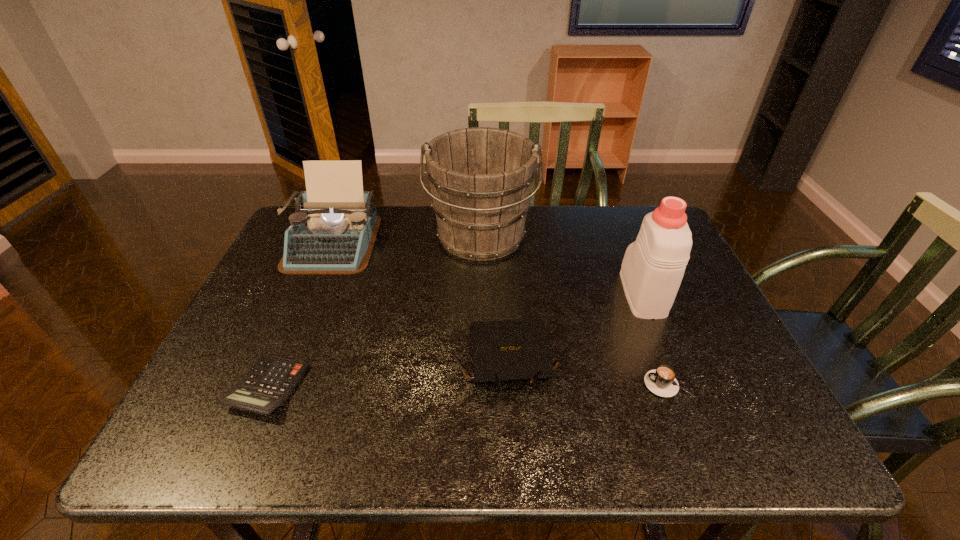
Identify which object is the second nearest to the third tallest object. Please provide its 2D coordinates. Your answer should be formatted as a tuple, i.e. [(x, y)], where the tuple contains the x and y coordinates of a point satisfying the conditions above.

[(268, 384)]

Where is `vacant area that satisfies the following two spatial constraints: 1. on the handle side of the bucket; 2. on the left side of the router`? vacant area that satisfies the following two spatial constraints: 1. on the handle side of the bucket; 2. on the left side of the router is located at coordinates (481, 360).